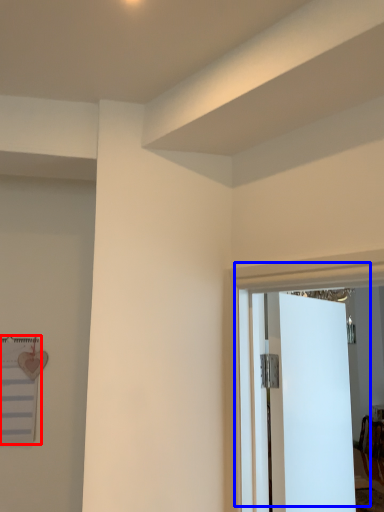
Question: Among these objects, which one is farthest to the camera, bulletin board (highlighted by a red box) or door (highlighted by a blue box)?

Choices:
 (A) bulletin board
 (B) door

Answer: (A)